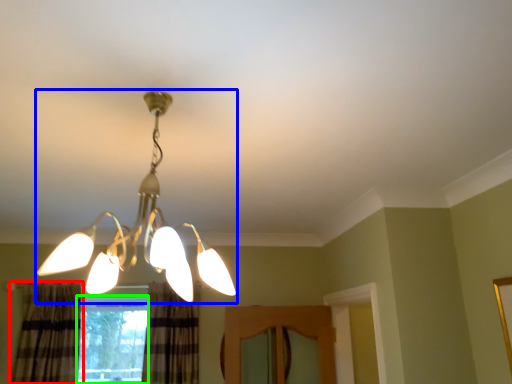
Question: Which object is the farthest from curtain (highlighted by a red box)? Choose among these: lamp (highlighted by a blue box) or window (highlighted by a green box).

Choices:
 (A) lamp
 (B) window

Answer: (A)